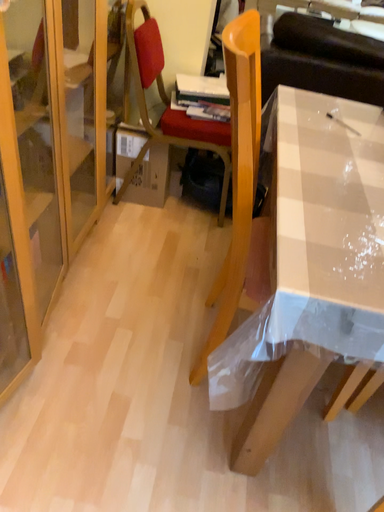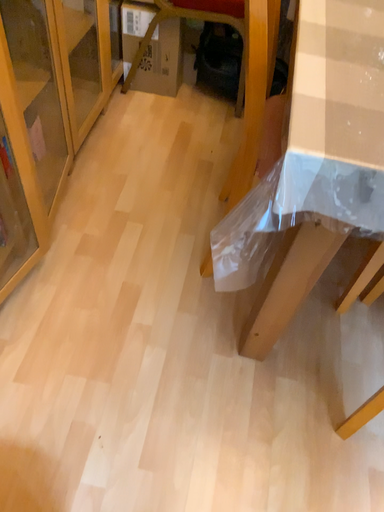
Question: How did the camera likely rotate when shooting the video?

Choices:
 (A) rotated upward
 (B) rotated downward

Answer: (B)